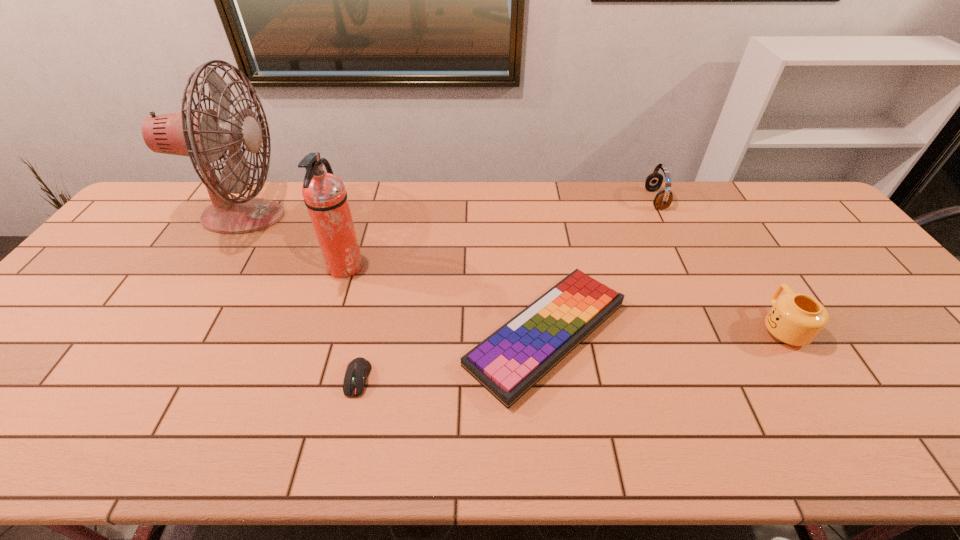
This screenshot has width=960, height=540. Find the location of `the tallest object`. the tallest object is located at coordinates (206, 135).

In order to click on the leftmost object in this screenshot , I will do `click(206, 135)`.

Find the location of `fire extinguisher`. fire extinguisher is located at coordinates (325, 197).

The height and width of the screenshot is (540, 960). I want to click on the second object from left to right, so click(325, 197).

Find the location of a particular element. The height and width of the screenshot is (540, 960). headset is located at coordinates (663, 199).

The height and width of the screenshot is (540, 960). In order to click on mug in this screenshot , I will do `click(796, 319)`.

At what (x,y) coordinates should I click in order to perform the action: click on computer keyboard. Please return your answer as a coordinate pair (x, y). The width and height of the screenshot is (960, 540). Looking at the image, I should click on (509, 362).

Locate an element on the screen. the fourth object from left to right is located at coordinates (509, 362).

This screenshot has height=540, width=960. I want to click on computer equipment, so click(x=357, y=371).

This screenshot has height=540, width=960. Identify the location of the third object from left to right. (357, 371).